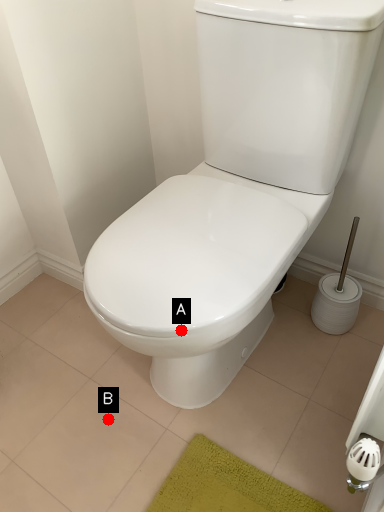
Question: Two points are circled on the image, labeled by A and B beside each circle. Which point is farther from the camera taking this photo?

Choices:
 (A) A is further
 (B) B is further

Answer: (B)